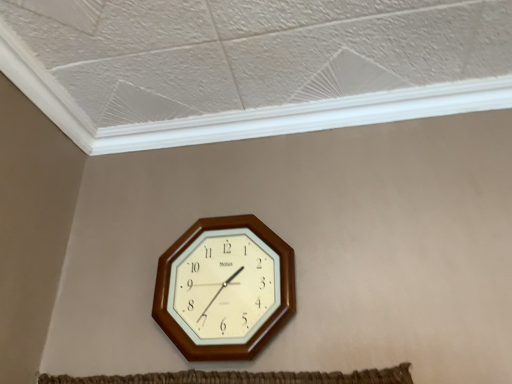
What is the approximate width of white plastic trim at upper center?

The width of white plastic trim at upper center is 2.41 inches.

This screenshot has height=384, width=512. Describe the element at coordinates (309, 116) in the screenshot. I see `white plastic trim at upper center` at that location.

Identify the location of white plastic trim at upper center. This screenshot has height=384, width=512. (309, 116).

Describe the element at coordinates (225, 288) in the screenshot. The width and height of the screenshot is (512, 384). I see `wooden wall clock at center` at that location.

In order to face wooden wall clock at center, should I rotate leftwards or rightwards?

Rotate your view left by about 4.268°.

Find the location of `wooden wall clock at center`. wooden wall clock at center is located at coordinates (225, 288).

The image size is (512, 384). What are the coordinates of `white plastic trim at upper center` in the screenshot? It's located at (309, 116).

Looking at this image, between wooden wall clock at center and white plastic trim at upper center, which one appears on the left side from the viewer's perspective?

From the viewer's perspective, wooden wall clock at center appears more on the left side.

Relative to white plastic trim at upper center, is wooden wall clock at center in front or behind?

Clearly, wooden wall clock at center is in front of white plastic trim at upper center.

Does point (167, 284) appear closer or farther from the camera than point (221, 135)?

Point (167, 284) appears to be closer to the viewer than point (221, 135).

From the image's perspective, does wooden wall clock at center appear higher than white plastic trim at upper center?

No.

From a real-world perspective, which is physically below, wooden wall clock at center or white plastic trim at upper center?

wooden wall clock at center, from a real-world perspective.

Is wooden wall clock at center wider than white plastic trim at upper center?

Incorrect, the width of wooden wall clock at center does not surpass that of white plastic trim at upper center.

Who is shorter, wooden wall clock at center or white plastic trim at upper center?

white plastic trim at upper center.

In terms of size, does wooden wall clock at center appear bigger or smaller than white plastic trim at upper center?

Considering their sizes, wooden wall clock at center takes up more space than white plastic trim at upper center.

Is wooden wall clock at center spatially inside white plastic trim at upper center, or outside of it?

wooden wall clock at center exists outside the volume of white plastic trim at upper center.

Is wooden wall clock at center far away from white plastic trim at upper center?

They are positioned close to each other.

Could you tell me if wooden wall clock at center is facing white plastic trim at upper center?

No, wooden wall clock at center is not oriented towards white plastic trim at upper center.

Measure the distance from wooden wall clock at center to white plastic trim at upper center.

wooden wall clock at center is 15.36 inches away from white plastic trim at upper center.

Locate an element on the screen. Image resolution: width=512 pixels, height=384 pixels. wall clock below the white plastic trim at upper center (from the image's perspective) is located at coordinates (225, 288).

Based on the photo, is white plastic trim at upper center at the left side of wooden wall clock at center?

No.

Which object is further away from the camera taking this photo, white plastic trim at upper center or wooden wall clock at center?

Positioned behind is white plastic trim at upper center.

Does point (490, 95) come behind point (228, 316)?

Yes, it is behind point (228, 316).

From the image's perspective, is white plastic trim at upper center located above or below wooden wall clock at center?

white plastic trim at upper center is situated higher than wooden wall clock at center in the image.

From a real-world perspective, who is located lower, white plastic trim at upper center or wooden wall clock at center?

wooden wall clock at center.

Which of these two, white plastic trim at upper center or wooden wall clock at center, is wider?

white plastic trim at upper center is wider.

Considering the sizes of objects white plastic trim at upper center and wooden wall clock at center in the image provided, who is shorter, white plastic trim at upper center or wooden wall clock at center?

white plastic trim at upper center is shorter.

Can you confirm if white plastic trim at upper center is smaller than wooden wall clock at center?

Yes, white plastic trim at upper center is smaller than wooden wall clock at center.

Is wooden wall clock at center inside white plastic trim at upper center?

No, wooden wall clock at center is located outside of white plastic trim at upper center.

Is there a large distance between white plastic trim at upper center and wooden wall clock at center?

No, white plastic trim at upper center is in close proximity to wooden wall clock at center.

Is white plastic trim at upper center aimed at wooden wall clock at center?

No.

Can you tell me how much white plastic trim at upper center and wooden wall clock at center differ in facing direction?

white plastic trim at upper center and wooden wall clock at center are facing 2.03 degrees away from each other.

The width and height of the screenshot is (512, 384). In the image, there is a white plastic trim at upper center. Find the location of `wall clock below it (from a real-world perspective)`. wall clock below it (from a real-world perspective) is located at coordinates (225, 288).

Find the location of a particular element. This screenshot has width=512, height=384. window frame above the wooden wall clock at center (from a real-world perspective) is located at coordinates (309, 116).

Identify the location of window frame that appears behind the wooden wall clock at center. (309, 116).